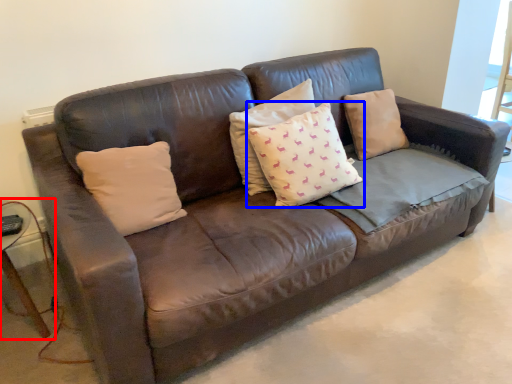
Question: Among these objects, which one is nearest to the camera, side table (highlighted by a red box) or pillow (highlighted by a blue box)?

Choices:
 (A) side table
 (B) pillow

Answer: (A)